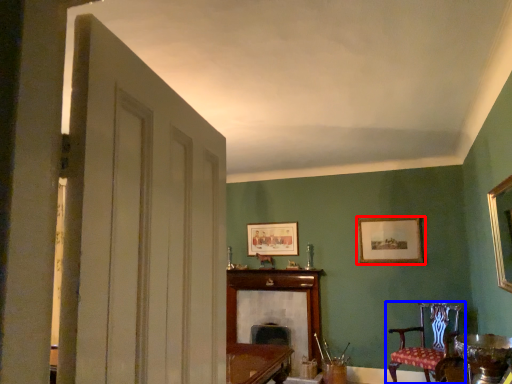
Question: Which object appears farthest to the camera in this image, picture frame (highlighted by a red box) or chair (highlighted by a blue box)?

Choices:
 (A) picture frame
 (B) chair

Answer: (A)